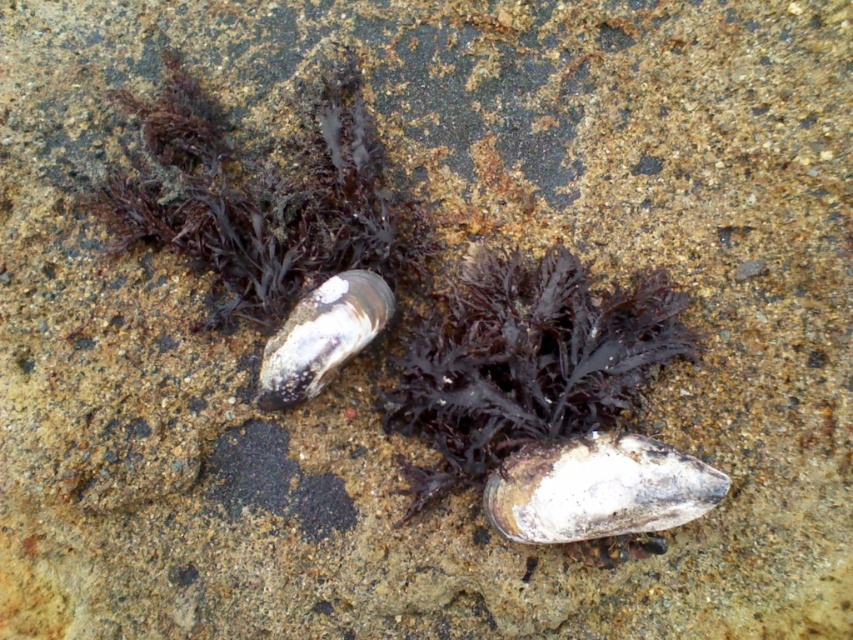
In the scene shown: Which is above, dark matte seaweed at center or white glossy oyster at center?

Positioned higher is white glossy oyster at center.

Describe the element at coordinates (525, 362) in the screenshot. This screenshot has height=640, width=853. I see `dark matte seaweed at center` at that location.

Who is more distant from viewer, (579,342) or (265,355)?

The point (579,342) is behind.

This screenshot has width=853, height=640. I want to click on dark matte seaweed at center, so click(525, 362).

Between dark matte seaweed at center and white matte oyster at center, which one has more height?

dark matte seaweed at center

Describe the element at coordinates (525, 362) in the screenshot. I see `dark matte seaweed at center` at that location.

The height and width of the screenshot is (640, 853). Find the location of `dark matte seaweed at center`. dark matte seaweed at center is located at coordinates (525, 362).

Between point (608, 502) and point (271, 406), which one is positioned behind?

Point (271, 406)

Does white matte oyster at center come behind white glossy oyster at center?

No, it is in front of white glossy oyster at center.

Which is in front, point (619, 483) or point (292, 394)?

Positioned in front is point (619, 483).

Identify the location of white matte oyster at center. click(598, 490).